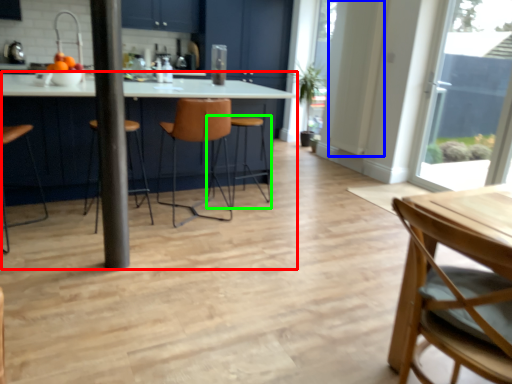
Question: Based on their relative distances, which object is nearer to kitchen & dining room table (highlighted by a red box)? Choose from door (highlighted by a blue box) and bar stool (highlighted by a green box).

Choices:
 (A) door
 (B) bar stool

Answer: (B)